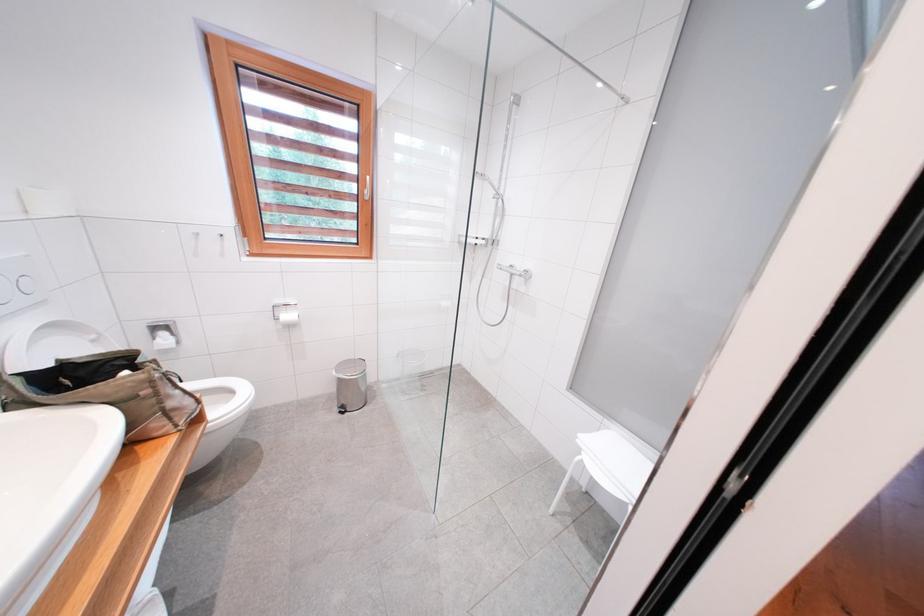
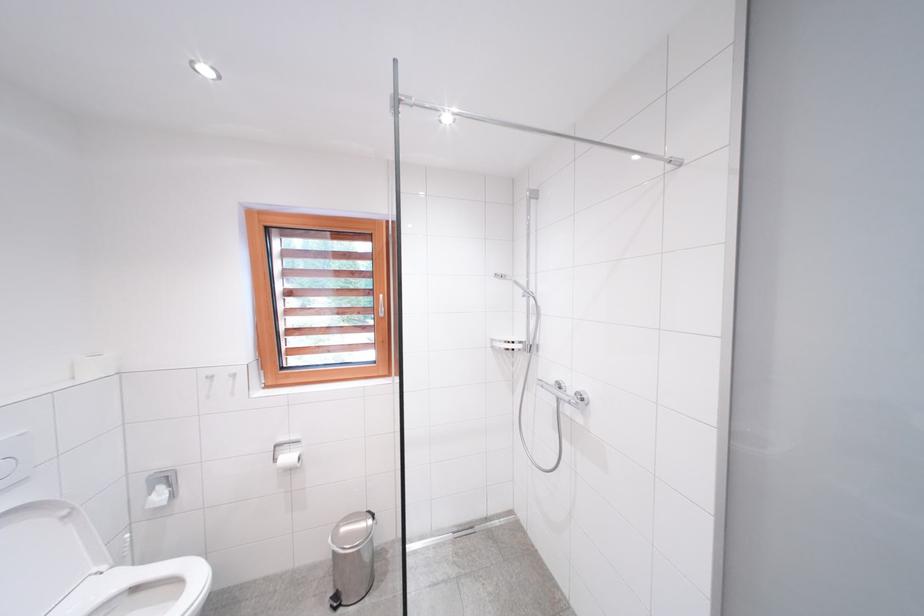
Which direction would the cameraman need to move to produce the second image?

The cameraman moved toward right, forward.